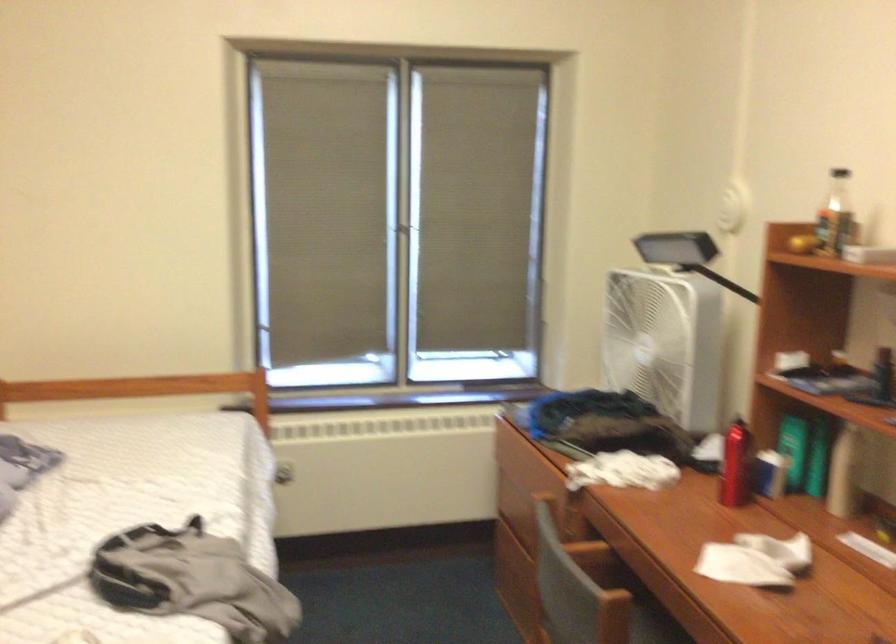
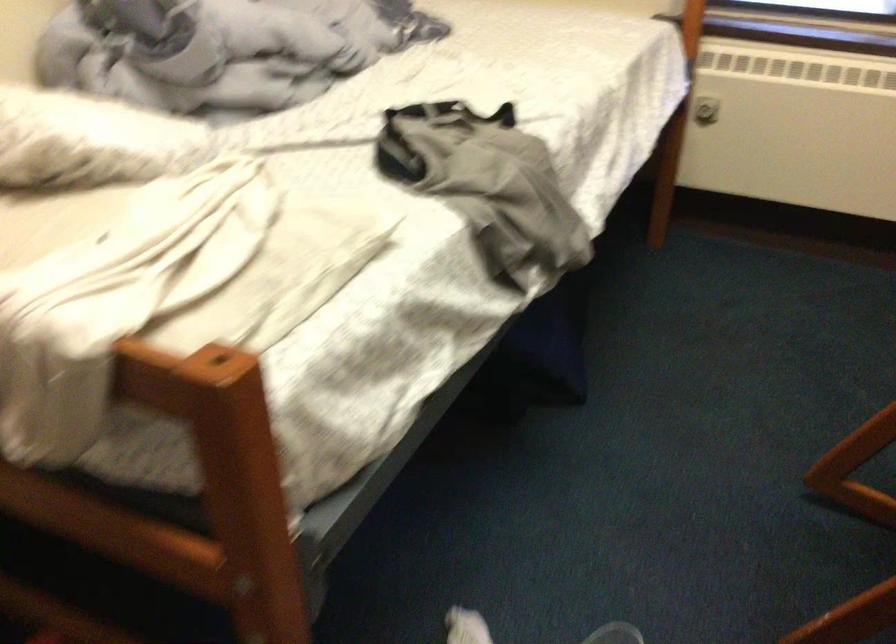
Based on the photo, the first image is from the beginning of the video and the second image is from the end. How did the camera likely rotate when shooting the video?

The camera rotated toward left-down.